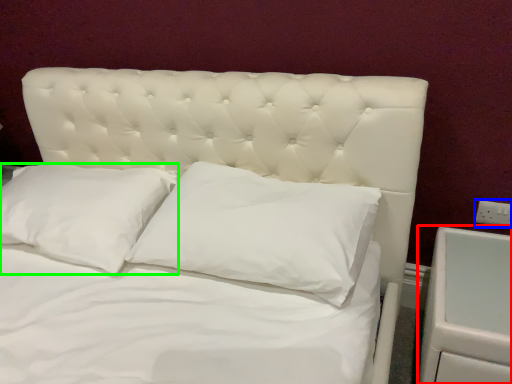
Question: Based on their relative distances, which object is nearer to dresser (highlighted by a red box)? Choose from electric outlet (highlighted by a blue box) and pillow (highlighted by a green box).

Choices:
 (A) electric outlet
 (B) pillow

Answer: (A)